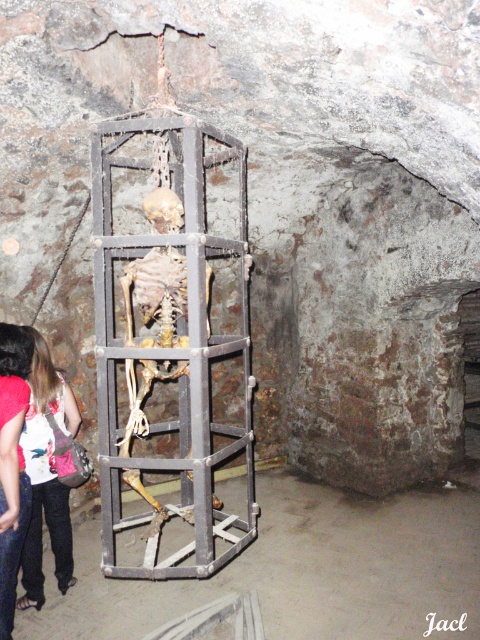
Question: Which point appears farthest from the camera in this image?

Choices:
 (A) (295, 515)
 (B) (100, 308)
 (C) (23, 461)

Answer: (A)

Question: Estimate the real-world distances between objects in this image. Which object is farther from the wooden cage at center?

Choices:
 (A) denim pants at lower left
 (B) rusty metal cage at center
 (C) denim jacket at lower left

Answer: (C)

Question: Which object appears closest to the camera in this image?

Choices:
 (A) rusty metal cage at center
 (B) denim pants at lower left
 (C) wooden cage at center
 (D) denim jacket at lower left

Answer: (A)

Question: Does rusty metal cage at center appear under denim pants at lower left?

Choices:
 (A) no
 (B) yes

Answer: (A)

Question: Does rusty metal cage at center have a lesser width compared to denim pants at lower left?

Choices:
 (A) yes
 (B) no

Answer: (B)

Question: Observing the image, what is the correct spatial positioning of rusty metal cage at center in reference to denim pants at lower left?

Choices:
 (A) left
 (B) right

Answer: (B)